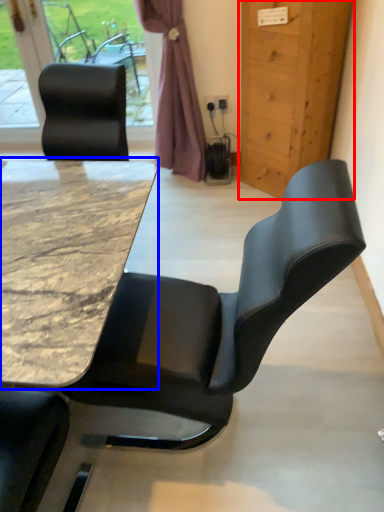
Question: Which object appears farthest to the camera in this image, door (highlighted by a red box) or table (highlighted by a blue box)?

Choices:
 (A) door
 (B) table

Answer: (A)